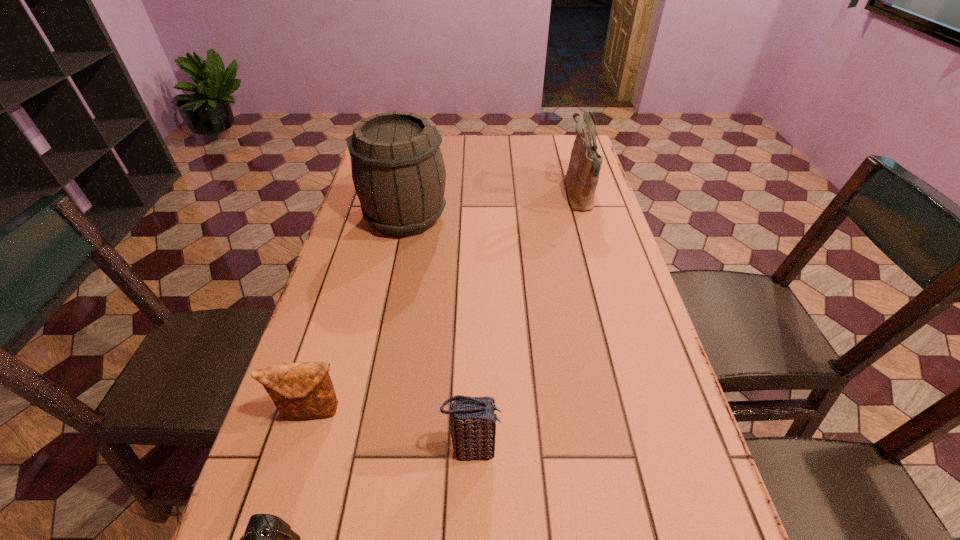
Image resolution: width=960 pixels, height=540 pixels. In order to click on vacant region located 0.090m on the open side of the third nearest object in this screenshot , I will do `click(294, 474)`.

Where is `wine bucket at the left edge`? The image size is (960, 540). wine bucket at the left edge is located at coordinates (398, 171).

Find the location of a particular element. clutch bag located in the left edge section of the desktop is located at coordinates (304, 390).

Where is `object that is at the right edge`? This screenshot has width=960, height=540. object that is at the right edge is located at coordinates (582, 176).

Where is `vacant space at the far edge`? vacant space at the far edge is located at coordinates (505, 160).

This screenshot has height=540, width=960. I want to click on free region at the left edge of the desktop, so click(x=311, y=453).

This screenshot has height=540, width=960. I want to click on vacant space at the right edge, so click(x=613, y=422).

The image size is (960, 540). Find the location of `vacant space at the far right corner of the desktop`. vacant space at the far right corner of the desktop is located at coordinates (554, 151).

The width and height of the screenshot is (960, 540). What are the coordinates of `unoccupied area between the farthest clutch bag and the second nearest object` in the screenshot? It's located at (393, 430).

You are a GUI agent. You are given a task and a screenshot of the screen. Output one action in this format:
    pyautogui.click(x=<x>, y=<y>)
    Task: Click on the free point between the wine bucket and the rightmost object
    
    Given the screenshot: What is the action you would take?
    pyautogui.click(x=492, y=206)